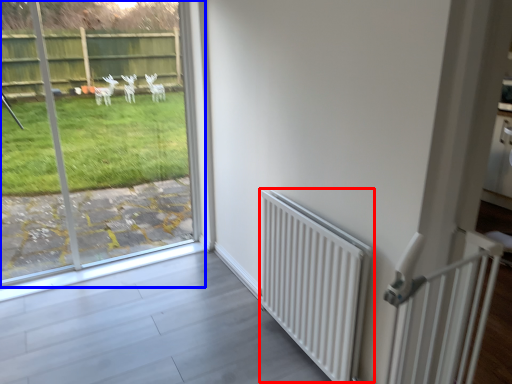
Question: Among these objects, which one is nearest to the camera, radiator (highlighted by a red box) or window (highlighted by a blue box)?

Choices:
 (A) radiator
 (B) window

Answer: (A)